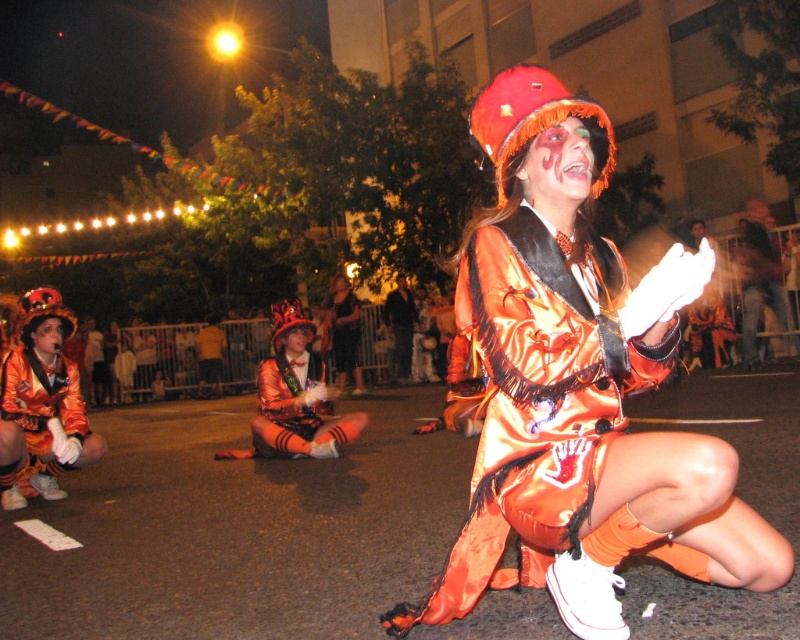
Can you confirm if matte orange satin costume at lower left is positioned to the right of satin/velvet costume at center?

No, matte orange satin costume at lower left is not to the right of satin/velvet costume at center.

Does point (78, 465) come closer to viewer compared to point (344, 365)?

Yes, it is in front of point (344, 365).

Is point (26, 404) less distant than point (345, 378)?

Yes, it is in front of point (345, 378).

Find the location of a particular element. The image size is (800, 640). matte orange satin costume at lower left is located at coordinates (x=42, y=404).

Who is more distant from viewer, (256, 451) or (358, 304)?

Point (358, 304)

Describe the element at coordinates (296, 410) in the screenshot. I see `satin/velvet shorts at center` at that location.

This screenshot has width=800, height=640. I want to click on satin/velvet shorts at center, so tap(296, 410).

Is satin/velvet jacket at center shorter than matte orange satin costume at lower left?

No.

Is point (632, 356) less distant than point (62, 355)?

Yes.

At what (x,y) coordinates should I click in order to perform the action: click on satin/velvet jacket at center. Please return your answer as a coordinate pair (x, y). Looking at the image, I should click on (532, 401).